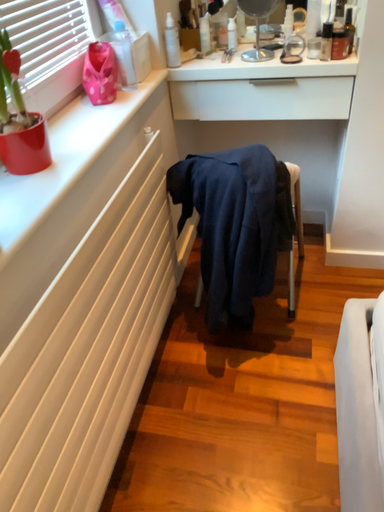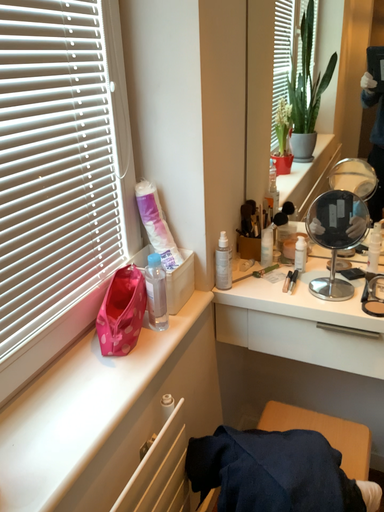
Question: Which way did the camera rotate in the video?

Choices:
 (A) rotated right
 (B) rotated left

Answer: (B)